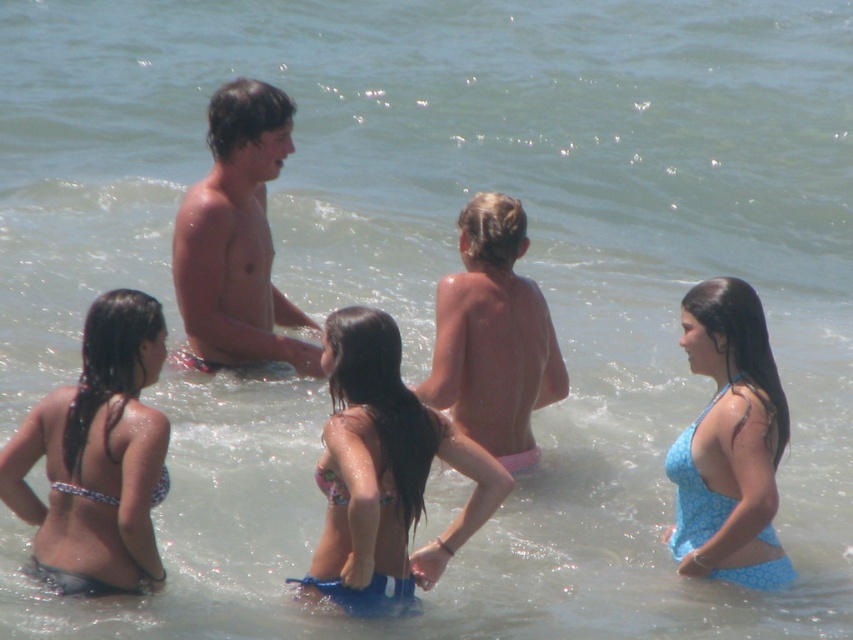
Question: Which of the following is the closest to the observer?

Choices:
 (A) (212, 250)
 (B) (325, 480)

Answer: (B)

Question: Is blue fabric swimsuit at center further to camera compared to blue printed swimsuit at center?

Choices:
 (A) yes
 (B) no

Answer: (B)

Question: Which point appears closest to the camera in this image?

Choices:
 (A) (758, 531)
 (B) (339, 467)

Answer: (B)

Question: Is smooth skin boy at center thinner than pink fabric boy at center?

Choices:
 (A) no
 (B) yes

Answer: (A)

Question: Is printed fabric bikini at lower left to the left of blue printed swimsuit at center from the viewer's perspective?

Choices:
 (A) no
 (B) yes

Answer: (B)

Question: Which point appears closest to the camera in this image?

Choices:
 (A) (183, 292)
 (B) (366, 316)
 (C) (74, 499)

Answer: (C)